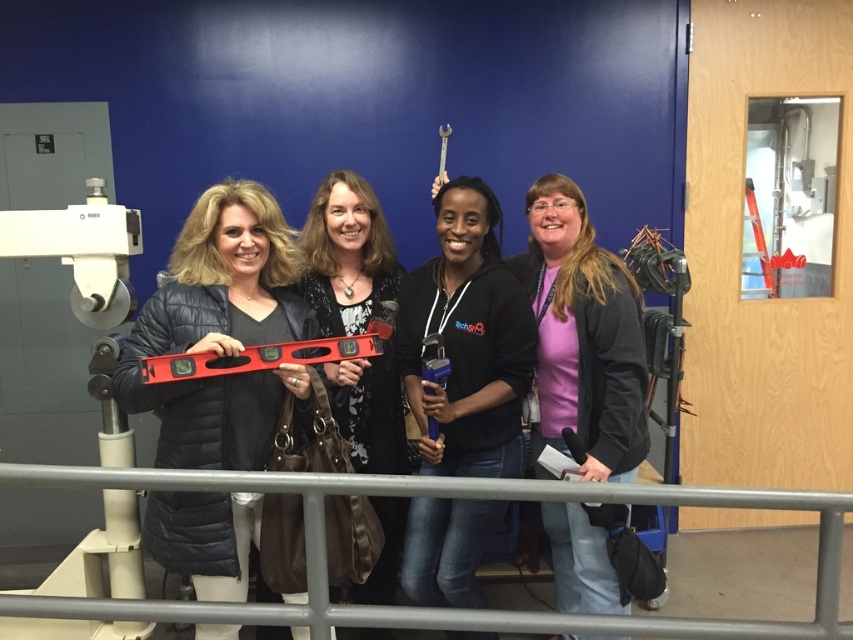
Is pink matte shirt at center in front of blue plastic level at center?

No, it is behind blue plastic level at center.

Is pink matte shirt at center thinner than blue plastic level at center?

No.

At what (x,y) coordinates should I click in order to perform the action: click on pink matte shirt at center. Please return your answer as a coordinate pair (x, y). Looking at the image, I should click on (583, 336).

Measure the distance between matte black jacket at center and camera.

1.74 meters

Is matte black jacket at center thinner than pink matte shirt at center?

No, matte black jacket at center is not thinner than pink matte shirt at center.

The height and width of the screenshot is (640, 853). Describe the element at coordinates (221, 332) in the screenshot. I see `matte black jacket at center` at that location.

I want to click on matte black jacket at center, so click(221, 332).

Who is more forward, [396,477] or [621,348]?

Positioned in front is point [396,477].

Does gray metal rail at lower center have a smaller size compared to pink matte shirt at center?

Yes.

Where is `gray metal rail at lower center`? gray metal rail at lower center is located at coordinates [x=444, y=609].

Where is `gray metal rail at lower center`? This screenshot has height=640, width=853. gray metal rail at lower center is located at coordinates (444, 609).